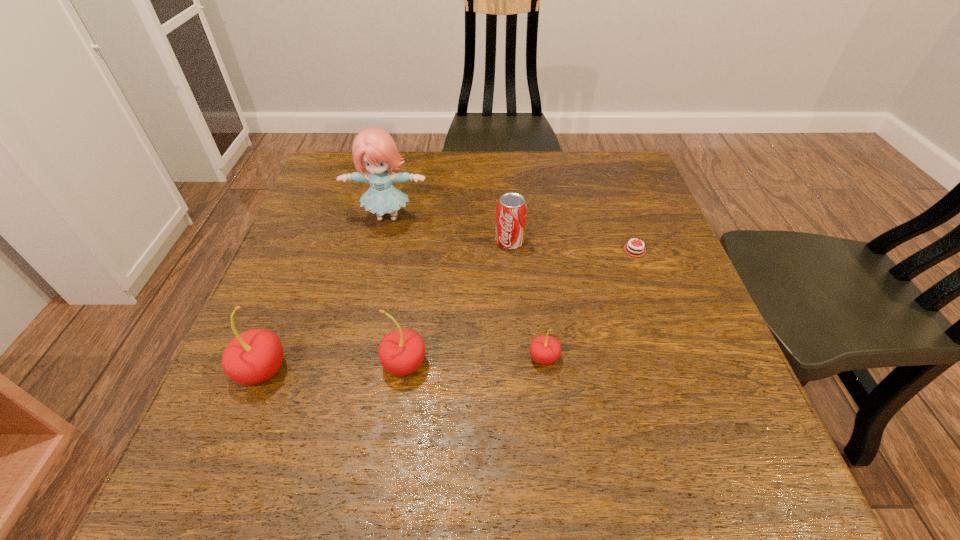
The image size is (960, 540). Find the location of `free region at the far edge`. free region at the far edge is located at coordinates (516, 183).

In the image, there is a desktop. Find the location of `free space at the near edge`. free space at the near edge is located at coordinates (362, 429).

I want to click on free spot at the left edge of the desktop, so click(x=300, y=253).

You are a GUI agent. You are given a task and a screenshot of the screen. Output one action in this format:
    pyautogui.click(x=<x>, y=<y>)
    Task: Click on the vacant space at the right edge
    Image resolution: width=960 pixels, height=540 pixels.
    Given the screenshot: What is the action you would take?
    pyautogui.click(x=676, y=327)

You are a GUI agent. You are given a task and a screenshot of the screen. Output one action in this format:
    pyautogui.click(x=<x>, y=<y>)
    Task: Click on the vacant space at the far right corner of the desktop
    This screenshot has width=960, height=540.
    Given the screenshot: What is the action you would take?
    pyautogui.click(x=601, y=186)

In the image, there is a desktop. Identify the location of vacant space at the near right corner. (680, 411).

This screenshot has width=960, height=540. Find the location of `empty space between the rightmost cherry and the soda can`. empty space between the rightmost cherry and the soda can is located at coordinates point(527,300).

You are a GUI agent. You are given a task and a screenshot of the screen. Output one action in this format:
    pyautogui.click(x=<x>, y=<y>)
    Task: Click on the vacant region between the farthest object and the leftmost object
    
    Given the screenshot: What is the action you would take?
    pyautogui.click(x=324, y=294)

Where is `vacant area that lies between the rightmost object and the soda can`? The image size is (960, 540). vacant area that lies between the rightmost object and the soda can is located at coordinates (572, 246).

Locate an element on the screen. The image size is (960, 540). vacant space in between the shortest cherry and the second cherry from left to right is located at coordinates (474, 361).